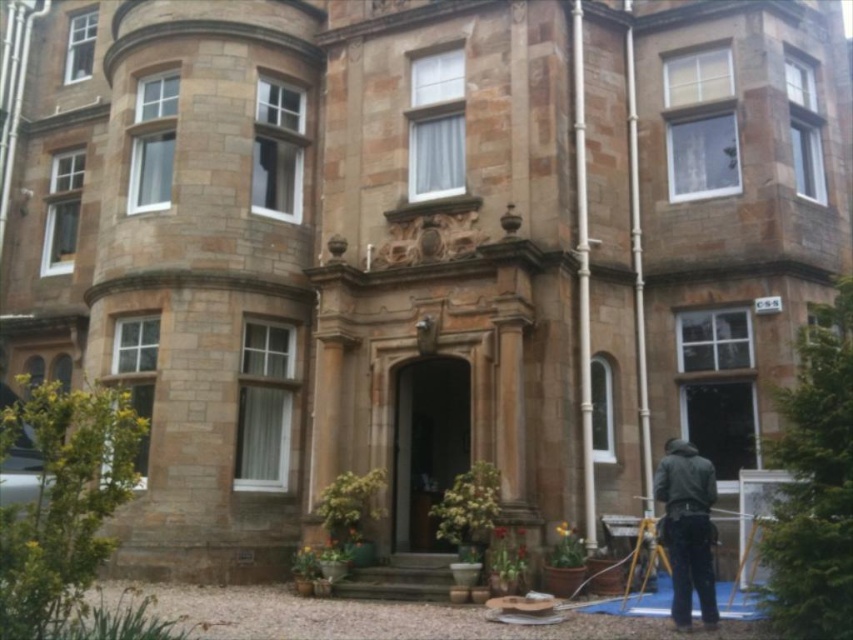
Question: Which point is closer to the camera?

Choices:
 (A) yellow metallic tripod at lower right
 (B) dark gray jacket at lower right

Answer: (B)

Question: Does dark gray jacket at lower right have a greater width compared to yellow metallic tripod at lower right?

Choices:
 (A) yes
 (B) no

Answer: (A)

Question: Considering the relative positions of dark gray jacket at lower right and yellow metallic tripod at lower right in the image provided, where is dark gray jacket at lower right located with respect to yellow metallic tripod at lower right?

Choices:
 (A) above
 (B) below

Answer: (A)

Question: Does dark gray jacket at lower right lie behind yellow metallic tripod at lower right?

Choices:
 (A) no
 (B) yes

Answer: (A)